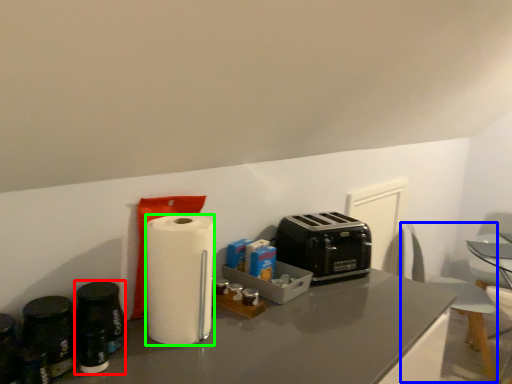
Question: Considering the real-world distances, which object is closest to appliance (highlighted by a red box)? swivel chair (highlighted by a blue box) or paper towel (highlighted by a green box).

Choices:
 (A) swivel chair
 (B) paper towel

Answer: (B)